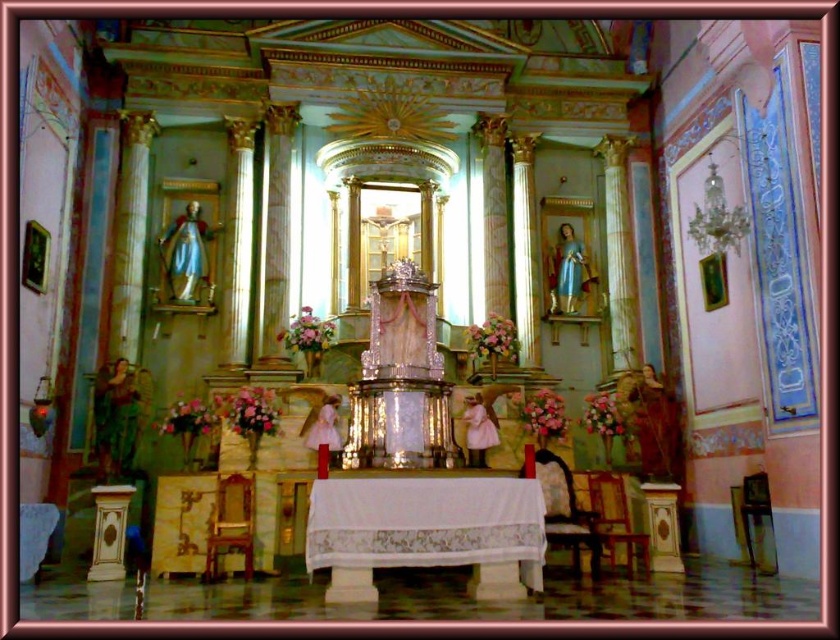
In the scene shown: You are standing at the entrance of the church and see the wooden upholstered chair at center marked by point (565, 509). If you walk straight towards the altar, will you pass directly in front of the chair?

The wooden upholstered chair at center is located at point (565, 509). Since the chair is at the center, walking straight towards the altar would mean you would pass directly in front of the chair.